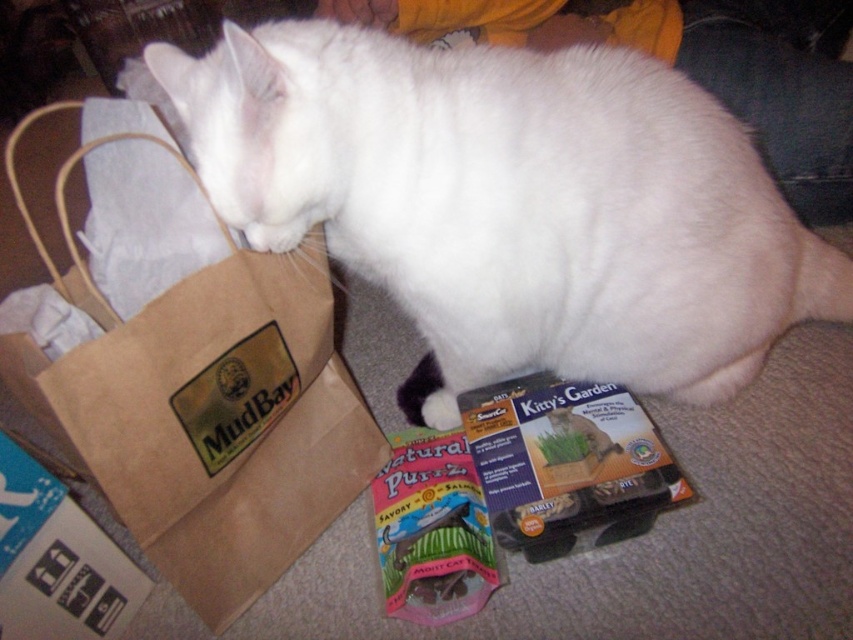
Looking at this image, you are a delivery robot trying to navigate to a specific location in the room. You see two points marked in the image. The first point is at coordinates point (399, 180) and the second is at point (206, 529). Which point is closer to you if you are facing the direction the cat is facing?

Point (399, 180) is in front of point (206, 529), so if you are facing the direction the cat is facing, the first point is closer to you.

You are a delivery person who just arrived at a house and need to place two boxes. The matte cardboard box at lower center and the blue cardboard box at lower left must be placed on a shelf that can only hold items up to the height of the taller box. Which box should you use as the height limit for the shelf?

The blue cardboard box at lower left is taller than the matte cardboard box at lower center. Therefore, the shelf should be set to the height of the blue cardboard box at lower left to accommodate both boxes.

You are a delivery person who just arrived at the house. You need to place a new package that is 1 meter long on the floor. The package must be placed where there is enough space. Looking at the scene, can you fit the package in the space where the matte cardboard box at lower center is located?

The matte cardboard box at lower center is 93.81 centimeters from viewer. Since the package is 1 meter long, which is 100 centimeters, it is slightly longer than the available space. Therefore, the package cannot be placed there without overlapping or moving other items.